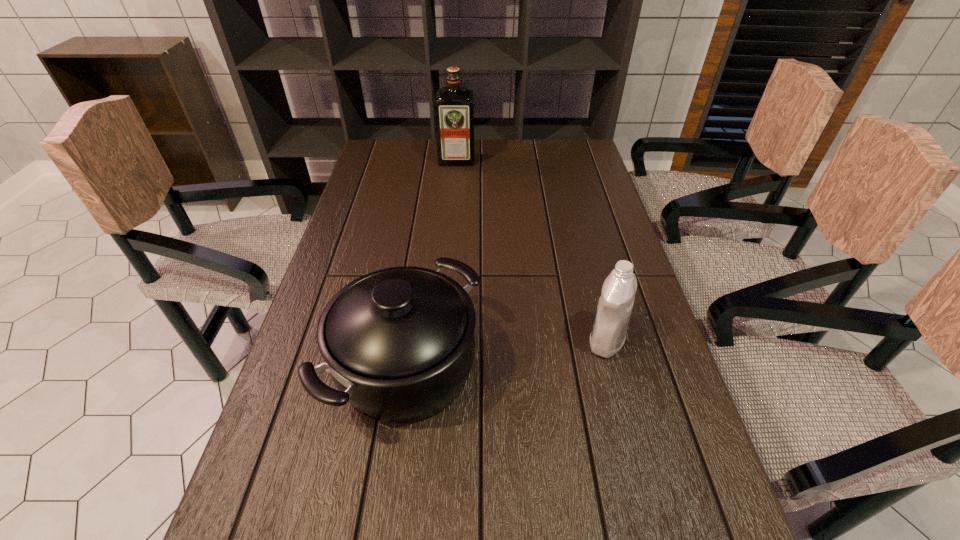
This screenshot has height=540, width=960. What are the coordinates of `vacant space at the left edge of the desktop` in the screenshot? It's located at (363, 198).

The height and width of the screenshot is (540, 960). Identify the location of free space at the right edge of the desktop. click(631, 510).

This screenshot has height=540, width=960. Identify the location of free space at the far right corner. (587, 153).

In order to click on vacant area that lies between the farthest object and the rightmost object in this screenshot , I will do `click(532, 250)`.

Locate an element on the screen. free space between the farthest object and the saucepan is located at coordinates (432, 263).

You are a GUI agent. You are given a task and a screenshot of the screen. Output one action in this format:
    pyautogui.click(x=<x>, y=<y>)
    Task: Click on the blank region between the farthest object and the saucepan
    
    Given the screenshot: What is the action you would take?
    pyautogui.click(x=432, y=263)

The height and width of the screenshot is (540, 960). I want to click on vacant space that's between the rightmost object and the liquor, so click(532, 250).

The height and width of the screenshot is (540, 960). I want to click on empty space that is in between the tallest object and the saucepan, so click(x=432, y=263).

You are a GUI agent. You are given a task and a screenshot of the screen. Output one action in this format:
    pyautogui.click(x=<x>, y=<y>)
    Task: Click on the object that is the closest to the liquor
    
    Given the screenshot: What is the action you would take?
    pyautogui.click(x=398, y=343)

Select which object appears as the second closest to the farthest object. Please provide its 2D coordinates. Your answer should be formatted as a tuple, i.e. [(x, y)], where the tuple contains the x and y coordinates of a point satisfying the conditions above.

[(615, 304)]